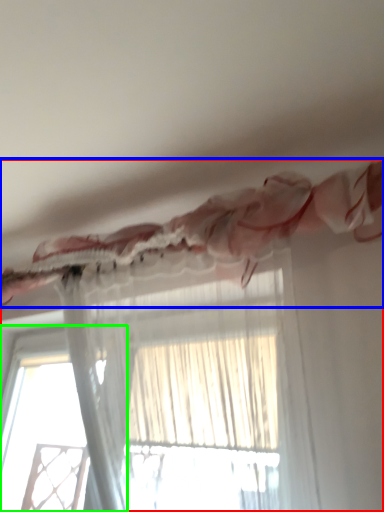
Question: Considering the real-world distances, which object is closest to curtain (highlighted by a red box)? curtain (highlighted by a blue box) or window (highlighted by a green box).

Choices:
 (A) curtain
 (B) window

Answer: (A)